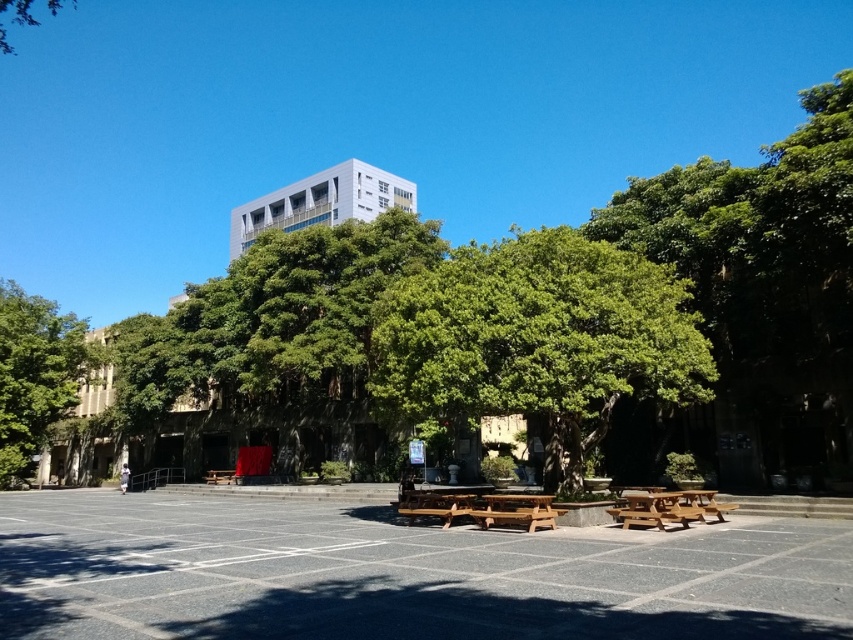
Question: Which point is closer to the camera taking this photo?

Choices:
 (A) (444, 522)
 (B) (730, 636)
 (C) (38, 358)

Answer: (B)

Question: Which is farther from the green leafy tree at center?

Choices:
 (A) green leafy tree at upper left
 (B) wooden park bench at center
 (C) gray concrete parking lot at center
 (D) green leafy tree at left

Answer: (D)

Question: Which point appears closest to the camera in this image?

Choices:
 (A) (9, 3)
 (B) (686, 516)

Answer: (B)

Question: Can you confirm if gray concrete parking lot at center is smaller than green leafy tree at left?

Choices:
 (A) no
 (B) yes

Answer: (B)

Question: Does wooden picnic table at center appear on the right side of green leafy tree at upper left?

Choices:
 (A) no
 (B) yes

Answer: (B)

Question: Does gray concrete parking lot at center have a greater width compared to brown wooden park bench at center?

Choices:
 (A) yes
 (B) no

Answer: (A)